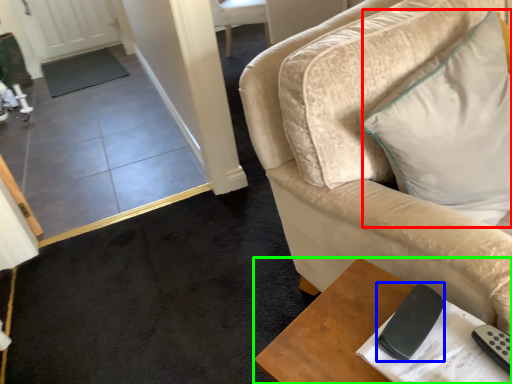
Question: Which object is positioned farthest from pillow (highlighted by a red box)? Select from remote (highlighted by a blue box) and table (highlighted by a green box).

Choices:
 (A) remote
 (B) table

Answer: (B)